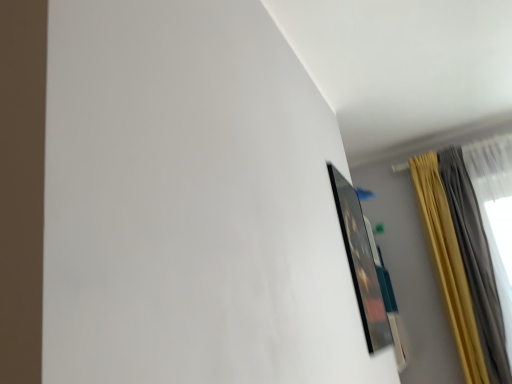
Where is `matte black picture frame at upper right`? matte black picture frame at upper right is located at coordinates (361, 263).

This screenshot has height=384, width=512. What do you see at coordinates (361, 263) in the screenshot?
I see `matte black picture frame at upper right` at bounding box center [361, 263].

You are a GUI agent. You are given a task and a screenshot of the screen. Output one action in this format:
    pyautogui.click(x=<x>, y=<y>)
    Task: Click on the silky yellow curtain at upper right
    
    Given the screenshot: What is the action you would take?
    pyautogui.click(x=462, y=264)

What do you see at coordinates (462, 264) in the screenshot? This screenshot has height=384, width=512. I see `silky yellow curtain at upper right` at bounding box center [462, 264].

Identify the location of matte black picture frame at upper right. This screenshot has width=512, height=384. (361, 263).

Considering the relative positions of silky yellow curtain at upper right and matte black picture frame at upper right in the image provided, is silky yellow curtain at upper right to the left or to the right of matte black picture frame at upper right?

Based on their positions, silky yellow curtain at upper right is located to the right of matte black picture frame at upper right.

Which object is further away from the camera taking this photo, silky yellow curtain at upper right or matte black picture frame at upper right?

Positioned behind is silky yellow curtain at upper right.

Which is behind, point (448, 267) or point (366, 230)?

The point (448, 267) is more distant.

From the image's perspective, between silky yellow curtain at upper right and matte black picture frame at upper right, which one is located above?

From the image's view, matte black picture frame at upper right is above.

Looking at this image, from a real-world perspective, is silky yellow curtain at upper right below matte black picture frame at upper right?

No, from a real-world perspective, silky yellow curtain at upper right is not under matte black picture frame at upper right.

Can you confirm if silky yellow curtain at upper right is thinner than matte black picture frame at upper right?

No, silky yellow curtain at upper right is not thinner than matte black picture frame at upper right.

In the scene shown: Which of these two, silky yellow curtain at upper right or matte black picture frame at upper right, stands shorter?

matte black picture frame at upper right is shorter.

Considering the relative sizes of silky yellow curtain at upper right and matte black picture frame at upper right in the image provided, is silky yellow curtain at upper right bigger than matte black picture frame at upper right?

Yes, silky yellow curtain at upper right is bigger than matte black picture frame at upper right.

Is silky yellow curtain at upper right spatially inside matte black picture frame at upper right, or outside of it?

The correct answer is: outside.

Can you see silky yellow curtain at upper right touching matte black picture frame at upper right?

No, silky yellow curtain at upper right is not in contact with matte black picture frame at upper right.

Is silky yellow curtain at upper right turned away from matte black picture frame at upper right?

silky yellow curtain at upper right is not turned away from matte black picture frame at upper right.

Can you tell me how much silky yellow curtain at upper right and matte black picture frame at upper right differ in facing direction?

The facing directions of silky yellow curtain at upper right and matte black picture frame at upper right are 86.3 degrees apart.

Where is `picture frame located in front of the silky yellow curtain at upper right`? The height and width of the screenshot is (384, 512). picture frame located in front of the silky yellow curtain at upper right is located at coordinates (361, 263).

In the scene shown: Which object is positioned more to the left, matte black picture frame at upper right or silky yellow curtain at upper right?

matte black picture frame at upper right.

Considering their positions, is matte black picture frame at upper right located in front of or behind silky yellow curtain at upper right?

Visually, matte black picture frame at upper right is located in front of silky yellow curtain at upper right.

Does point (349, 243) come closer to viewer compared to point (442, 194)?

Yes.

From the image's perspective, does matte black picture frame at upper right appear lower than silky yellow curtain at upper right?

Incorrect, from the image's perspective, matte black picture frame at upper right is higher than silky yellow curtain at upper right.

From a real-world perspective, is matte black picture frame at upper right physically located above or below silky yellow curtain at upper right?

matte black picture frame at upper right is below silky yellow curtain at upper right.

Considering the sizes of objects matte black picture frame at upper right and silky yellow curtain at upper right in the image provided, who is thinner, matte black picture frame at upper right or silky yellow curtain at upper right?

matte black picture frame at upper right.

From their relative heights in the image, would you say matte black picture frame at upper right is taller or shorter than silky yellow curtain at upper right?

matte black picture frame at upper right is shorter than silky yellow curtain at upper right.

Based on their sizes in the image, would you say matte black picture frame at upper right is bigger or smaller than silky yellow curtain at upper right?

Clearly, matte black picture frame at upper right is smaller in size than silky yellow curtain at upper right.

Does matte black picture frame at upper right contain silky yellow curtain at upper right?

No, silky yellow curtain at upper right is not surrounded by matte black picture frame at upper right.

Does matte black picture frame at upper right touch silky yellow curtain at upper right?

No, matte black picture frame at upper right is not touching silky yellow curtain at upper right.

Is matte black picture frame at upper right positioned with its back to silky yellow curtain at upper right?

No, matte black picture frame at upper right is not facing away from silky yellow curtain at upper right.

How different are the orientations of matte black picture frame at upper right and silky yellow curtain at upper right in degrees?

86.3 degrees.

Measure the distance between matte black picture frame at upper right and silky yellow curtain at upper right.

They are 4.26 feet apart.

Locate an element on the screen. The width and height of the screenshot is (512, 384). picture frame below the silky yellow curtain at upper right (from a real-world perspective) is located at coordinates (361, 263).

What are the coordinates of `curtain on the right of matte black picture frame at upper right` in the screenshot? It's located at pos(462,264).

Where is `picture frame beneath the silky yellow curtain at upper right (from a real-world perspective)`? Image resolution: width=512 pixels, height=384 pixels. picture frame beneath the silky yellow curtain at upper right (from a real-world perspective) is located at coordinates (361, 263).